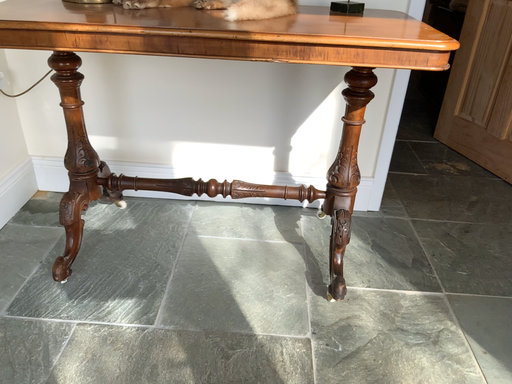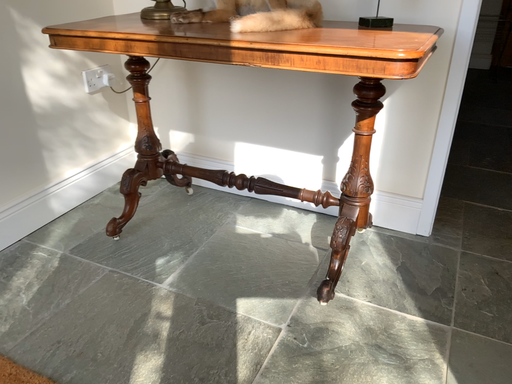
Question: How did the camera likely rotate when shooting the video?

Choices:
 (A) rotated left
 (B) rotated right

Answer: (A)